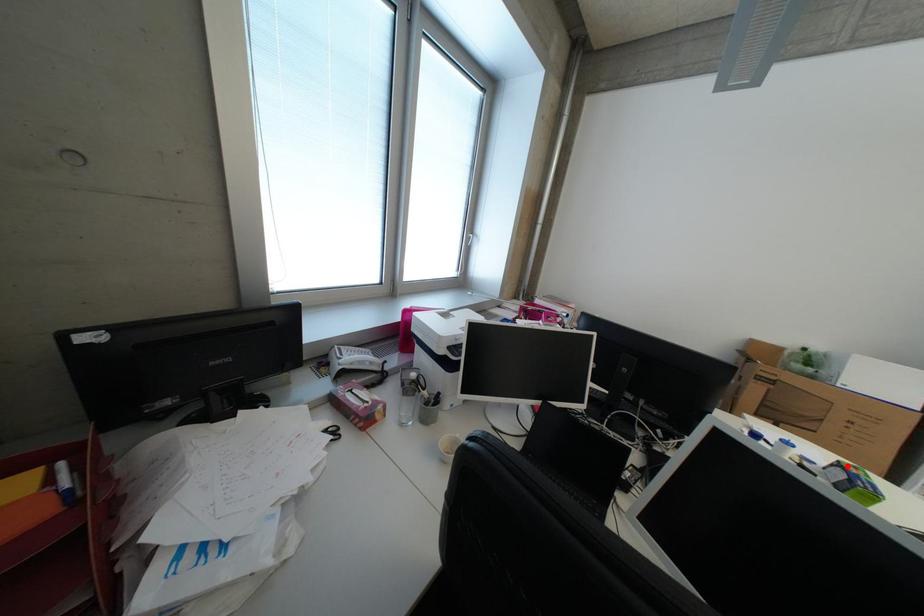
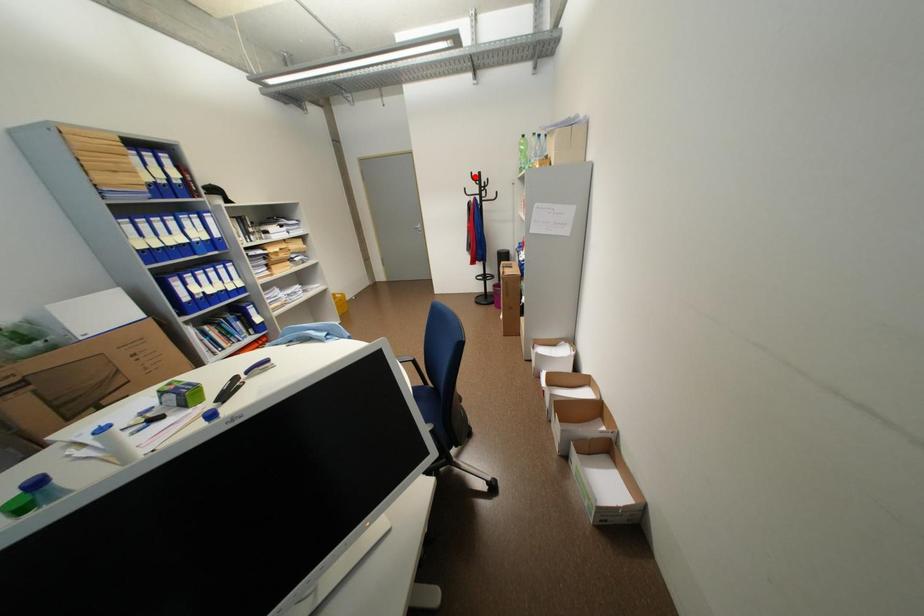
I am providing you with two images of the same scene from different viewpoints. A red point is marked on the first image and another point is marked on the second image. Is the marked point in image1 the same physical position as the marked point in image2?

No